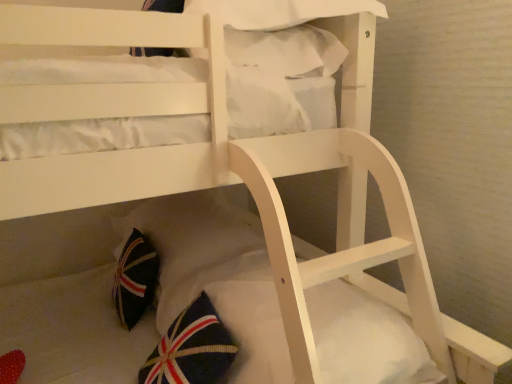
Question: Is white soft mattress at lower center positioned in front of dark blue fabric pillow at lower center, the first pillow ordered from the bottom?

Choices:
 (A) no
 (B) yes

Answer: (B)

Question: Can you confirm if white soft mattress at lower center is smaller than dark blue fabric pillow at lower center, the first pillow ordered from the bottom?

Choices:
 (A) yes
 (B) no

Answer: (A)

Question: Considering the relative sizes of white soft mattress at lower center and dark blue fabric pillow at lower center, the first pillow ordered from the bottom, in the image provided, is white soft mattress at lower center shorter than dark blue fabric pillow at lower center, the first pillow ordered from the bottom,?

Choices:
 (A) no
 (B) yes

Answer: (B)

Question: Is white soft mattress at lower center further to camera compared to dark blue fabric pillow at lower center, the first pillow ordered from the bottom?

Choices:
 (A) no
 (B) yes

Answer: (A)

Question: Considering the relative sizes of white soft mattress at lower center and dark blue fabric pillow at lower center, the first pillow ordered from the bottom, in the image provided, is white soft mattress at lower center wider than dark blue fabric pillow at lower center, the first pillow ordered from the bottom,?

Choices:
 (A) no
 (B) yes

Answer: (A)

Question: From the image's perspective, does white soft mattress at lower center appear lower than dark blue fabric pillow at lower center, the first pillow ordered from the bottom?

Choices:
 (A) yes
 (B) no

Answer: (A)

Question: Are dark blue fabric pillow at lower center, which appears as the second pillow when viewed from the top, and white fabric pillow at upper center, which is counted as the 2th pillow, starting from the bottom, far apart?

Choices:
 (A) no
 (B) yes

Answer: (A)

Question: Can you confirm if dark blue fabric pillow at lower center, which appears as the second pillow when viewed from the top, is smaller than white fabric pillow at upper center, which is counted as the 2th pillow, starting from the bottom?

Choices:
 (A) yes
 (B) no

Answer: (B)

Question: From the image's perspective, is dark blue fabric pillow at lower center, the first pillow ordered from the bottom, beneath white fabric pillow at upper center, which is counted as the 2th pillow, starting from the bottom?

Choices:
 (A) yes
 (B) no

Answer: (A)

Question: Considering the relative positions of dark blue fabric pillow at lower center, which appears as the second pillow when viewed from the top, and white fabric pillow at upper center, which is counted as the 2th pillow, starting from the bottom, in the image provided, is dark blue fabric pillow at lower center, which appears as the second pillow when viewed from the top, to the left of white fabric pillow at upper center, which is counted as the 2th pillow, starting from the bottom, from the viewer's perspective?

Choices:
 (A) no
 (B) yes

Answer: (B)

Question: Could white fabric pillow at upper center, the 1th pillow positioned from the top, be considered to be inside dark blue fabric pillow at lower center, the first pillow ordered from the bottom?

Choices:
 (A) yes
 (B) no

Answer: (B)

Question: Considering the relative sizes of dark blue fabric pillow at lower center, which appears as the second pillow when viewed from the top, and white fabric pillow at upper center, the 1th pillow positioned from the top, in the image provided, is dark blue fabric pillow at lower center, which appears as the second pillow when viewed from the top, wider than white fabric pillow at upper center, the 1th pillow positioned from the top,?

Choices:
 (A) yes
 (B) no

Answer: (A)

Question: Is white fabric pillow at upper center, the 1th pillow positioned from the top, to the left of white soft mattress at lower center from the viewer's perspective?

Choices:
 (A) no
 (B) yes

Answer: (B)